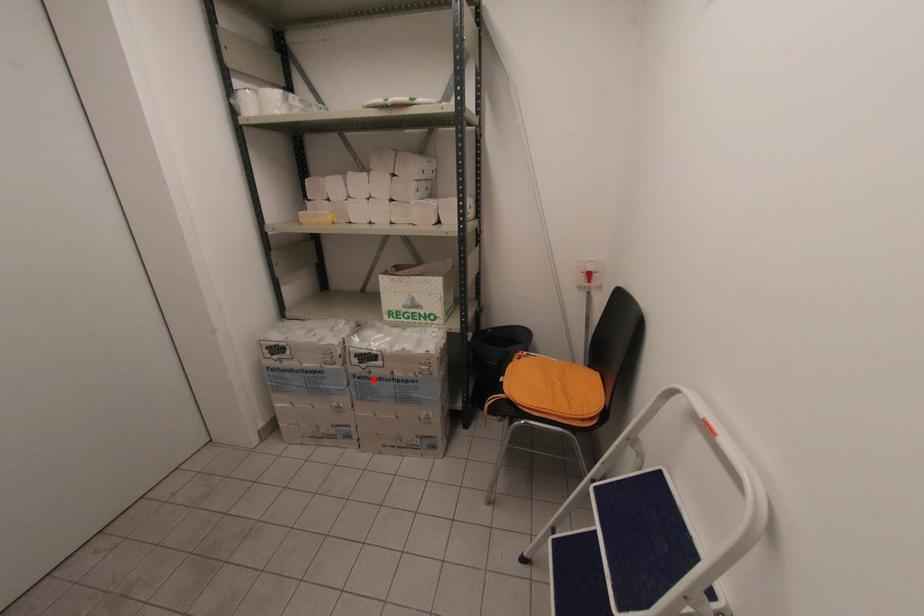
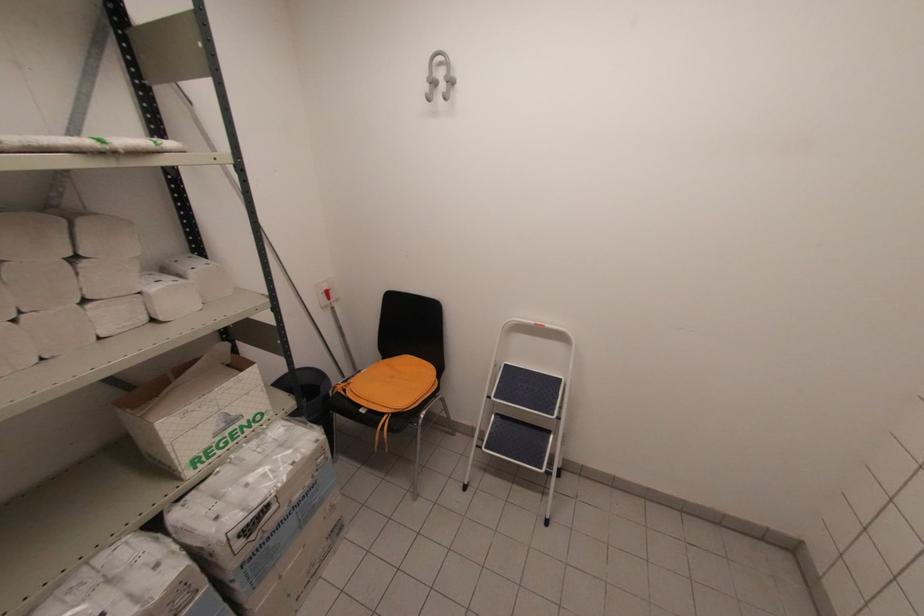
Locate, in the second image, the point that corresponds to the highlighted location in the first image.

(271, 539)